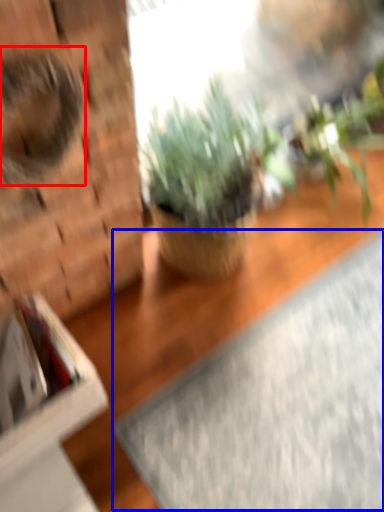
Question: Which object appears closest to the camera in this image, animal (highlighted by a red box) or yoga mat (highlighted by a blue box)?

Choices:
 (A) animal
 (B) yoga mat

Answer: (A)